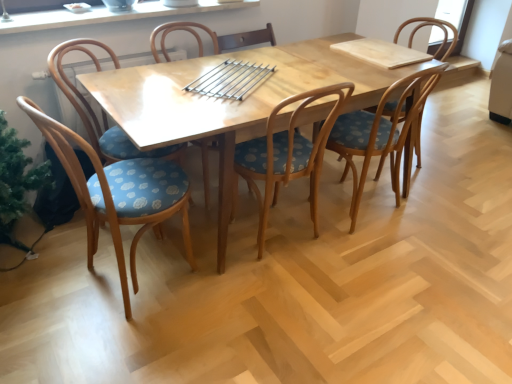
Where is `vacant region below wooden chair with blue polka dot seat cushion at center, the 2th chair when ordered from right to left (from a real-world perspective)`? This screenshot has width=512, height=384. vacant region below wooden chair with blue polka dot seat cushion at center, the 2th chair when ordered from right to left (from a real-world perspective) is located at coordinates (378, 219).